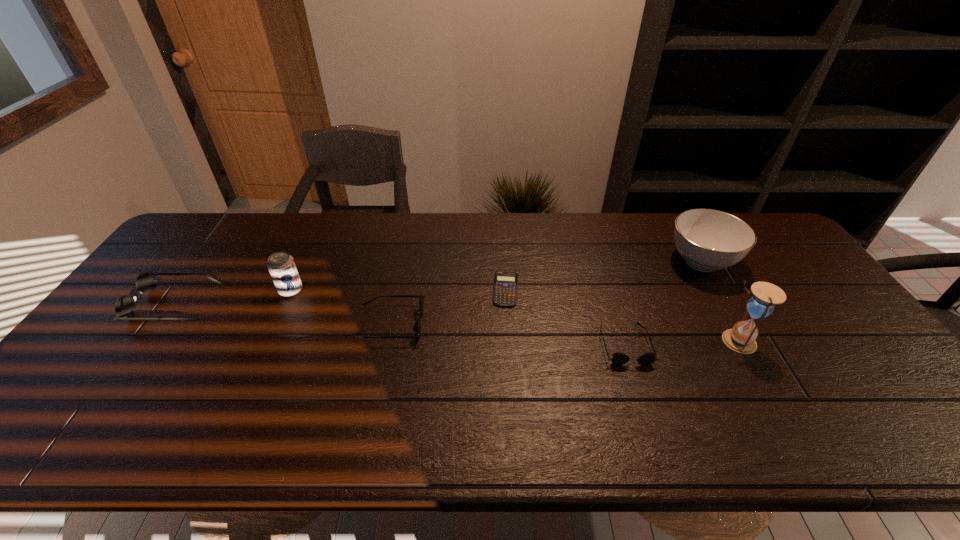
In the current image, all sunglassess are evenly spaced. To maintain this equal spacing, where should an additional sunglasses be placed on the right? Please point out a free spot. Please provide its 2D coordinates. Your answer should be formatted as a tuple, i.e. [(x, y)], where the tuple contains the x and y coordinates of a point satisfying the conditions above.

[(882, 367)]